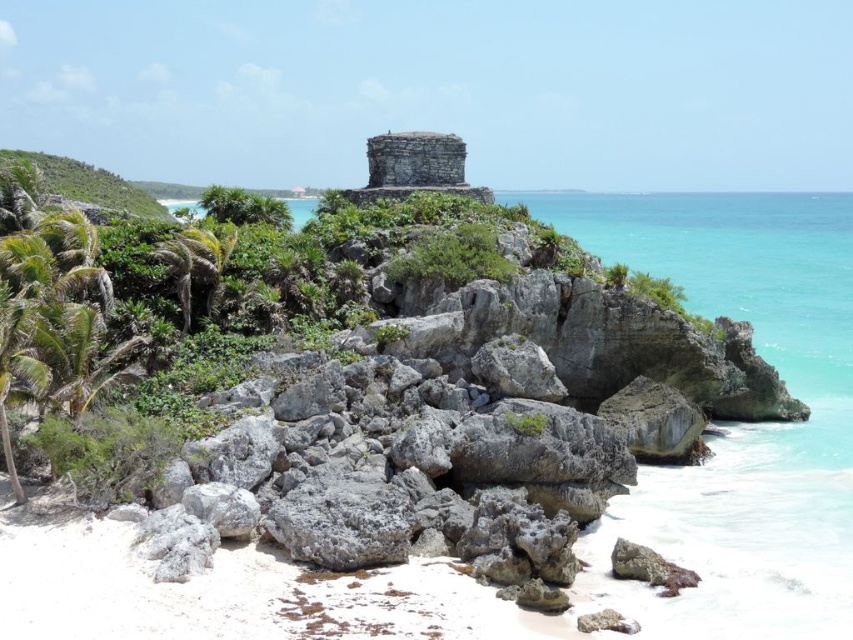
You are a photographer planning to capture the turquoise water at center and the green leafy palm tree at left in a single frame. Based on their relative heights, which object should appear taller in your photo?

The turquoise water at center has a greater height compared to the green leafy palm tree at left, so it should appear taller in the photo.

You are standing on the beach and want to take a photo of both the turquoise water at center and the green leafy palm tree at left. Which object should you focus on first to ensure both are in the frame?

The turquoise water at center is in front of the green leafy palm tree at left, so you should focus on the green leafy palm tree at left first to ensure both are in the frame.